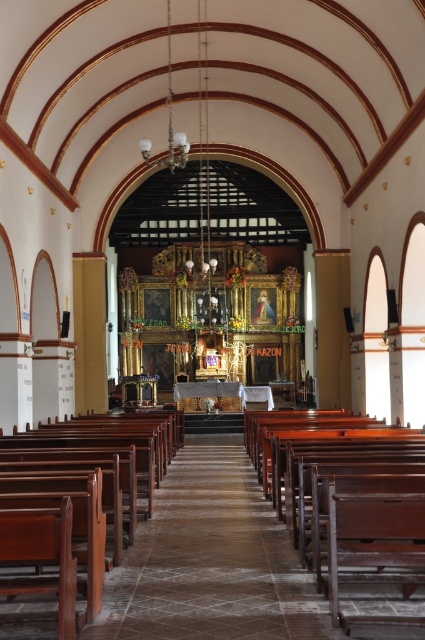
You are standing in the church and see two points marked on the floor. The first point is at coordinates point (322,412) and the second point is at point (96,445). Which point is closer to you?

Point (322,412) is closer to you because it is further to the viewer than point (96,445).

You are a visitor sitting on the mahogany wood church bench at center and want to move to the brown polished wood church bench at center. In which direction should you move to reach it?

The mahogany wood church bench at center is positioned on the right side of brown polished wood church bench at center, so you should move to the left to reach it.

You are a visitor entering the church and need to choose between sitting on the mahogany wood church bench at center or the brown polished wood church bench at center. Which bench offers more seating space due to its width?

The mahogany wood church bench at center offers more seating space because its width surpasses that of the brown polished wood church bench at center.